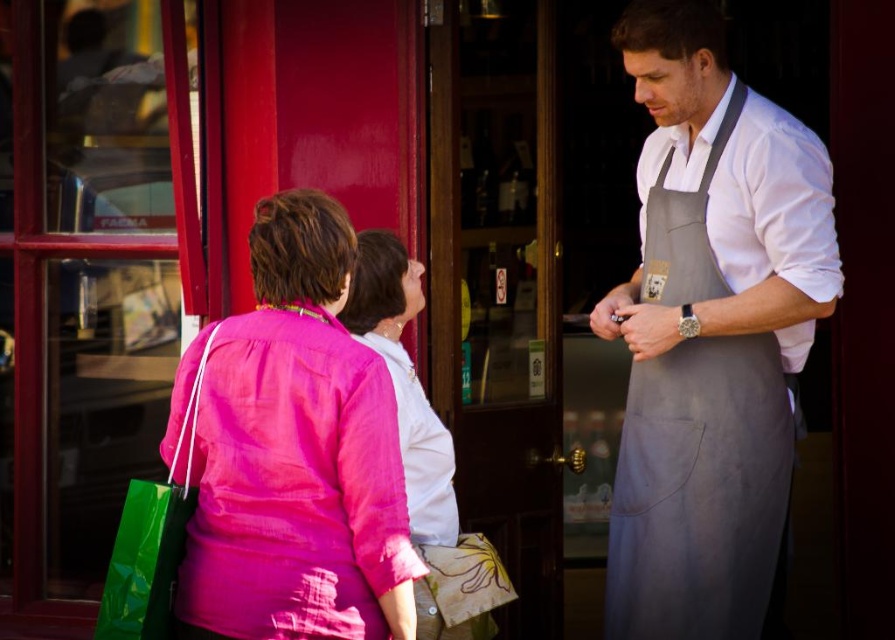
Is gray fabric apron at center smaller than pink fabric blouse at center?

Incorrect, gray fabric apron at center is not smaller in size than pink fabric blouse at center.

You are a GUI agent. You are given a task and a screenshot of the screen. Output one action in this format:
    pyautogui.click(x=<x>, y=<y>)
    Task: Click on the gray fabric apron at center
    The width and height of the screenshot is (895, 640).
    Given the screenshot: What is the action you would take?
    pyautogui.click(x=710, y=332)

Who is more distant from viewer, [721,342] or [425,448]?

Positioned behind is point [425,448].

Find the location of a particular element. gray fabric apron at center is located at coordinates (710, 332).

Between point (672, 573) and point (348, 490), which one is positioned in front?

Point (348, 490) is more forward.

Is point (771, 381) more distant than point (305, 308)?

Yes, point (771, 381) is behind point (305, 308).

Find the location of a particular element. The width and height of the screenshot is (895, 640). gray fabric apron at center is located at coordinates (710, 332).

Does pink fabric shirt at center have a greater height compared to pink fabric blouse at center?

Incorrect, pink fabric shirt at center's height is not larger of pink fabric blouse at center's.

Which is in front, point (263, 435) or point (393, 362)?

Point (263, 435) is in front.

Is point (250, 438) farther from viewer compared to point (414, 532)?

No.

Find the location of a particular element. pink fabric shirt at center is located at coordinates (293, 452).